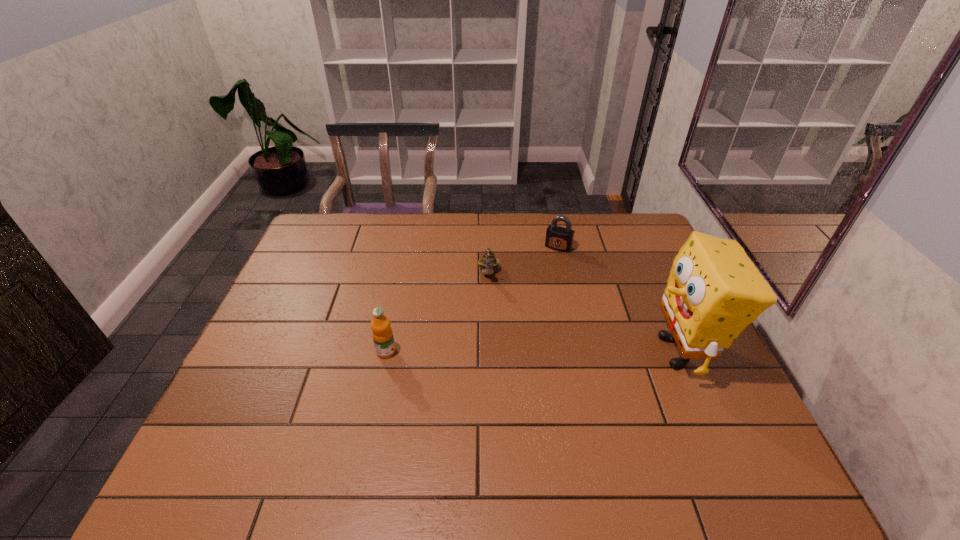
Locate an element on the screen. This screenshot has width=960, height=540. the leftmost object is located at coordinates (382, 334).

Find the location of `orange juice`. orange juice is located at coordinates (382, 334).

Identify the location of the rightmost object. (714, 290).

At what (x,y) coordinates should I click in order to perform the action: click on sponge. Please return your answer as a coordinate pair (x, y). Looking at the image, I should click on (714, 290).

Identify the location of the third object from right to left. The height and width of the screenshot is (540, 960). click(x=488, y=261).

Image resolution: width=960 pixels, height=540 pixels. I want to click on snail, so click(488, 261).

Identify the location of the second object from right to left. The height and width of the screenshot is (540, 960). (558, 238).

The height and width of the screenshot is (540, 960). Identify the location of the farthest object. (558, 238).

Locate an element on the screen. Image resolution: width=960 pixels, height=540 pixels. vacant area situated 0.230m on the label of the orange juice is located at coordinates (482, 352).

You are a GUI agent. You are given a task and a screenshot of the screen. Output one action in this format:
    pyautogui.click(x=<x>, y=<y>)
    Task: Click on the blank area located 0.170m on the face of the tallest object
    
    Given the screenshot: What is the action you would take?
    pyautogui.click(x=582, y=352)